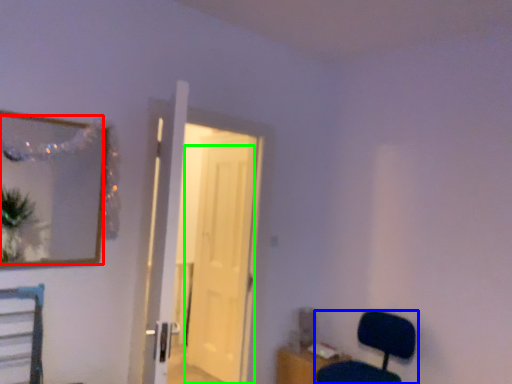
Question: Considering the real-world distances, which object is farthest from mirror (highlighted by a red box)? chair (highlighted by a blue box) or door (highlighted by a green box)?

Choices:
 (A) chair
 (B) door

Answer: (A)